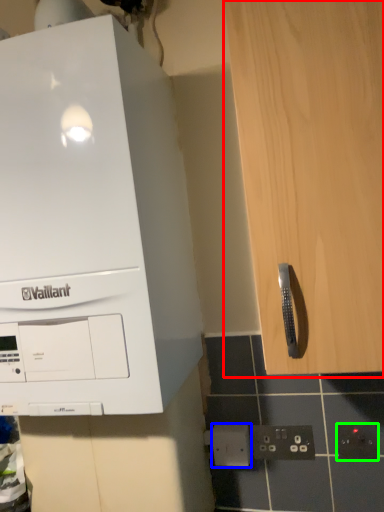
Question: Considering the real-world distances, which object is closest to cabinetry (highlighted by a red box)? electric outlet (highlighted by a blue box) or electric outlet (highlighted by a green box).

Choices:
 (A) electric outlet
 (B) electric outlet

Answer: (B)